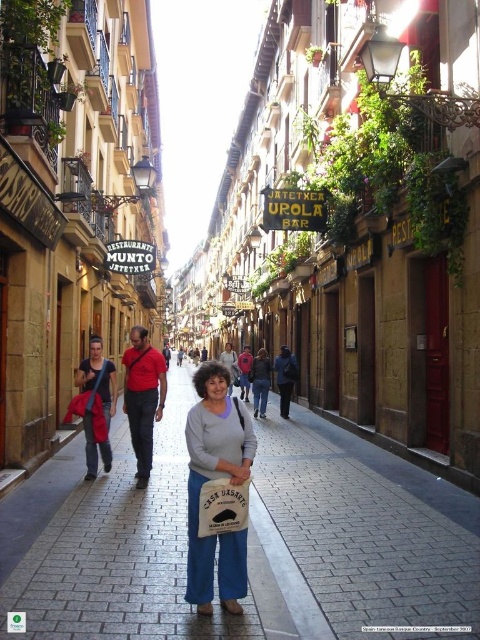
You are standing on the cobblestone street and want to take a photo of the historic buildings. Where exactly should you position yourself to ensure the brown brick pavement at center is in the frame?

You should position yourself at point [248,541] to ensure the brown brick pavement at center is in the frame.

What is the location of the point labeled as point (x=248, y=541) in the image?

The point labeled as point (x=248, y=541) is located on the brown brick pavement at center.

You are a tourist standing on the cobblestone street and want to take a photo that includes both the point at coordinates point (347, 540) and point (190, 545). Which point is closer to you, the tourist?

Point (190, 545) is closer to you because it is less further to the viewer than point (347, 540).